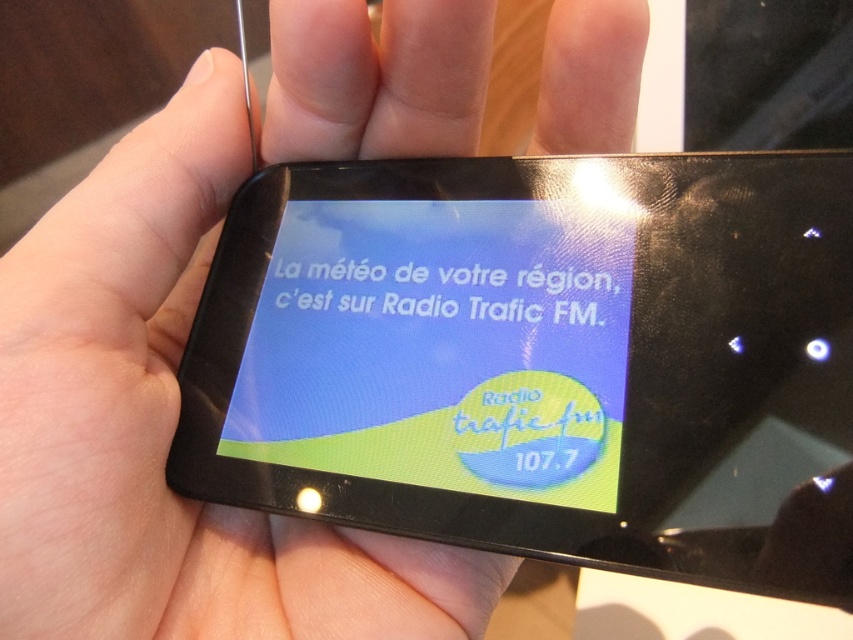
The image size is (853, 640). What do you see at coordinates (440, 348) in the screenshot? I see `matte black screen at center` at bounding box center [440, 348].

Is point (329, 308) closer to viewer compared to point (521, 292)?

That is False.

Between point (548, 236) and point (350, 266), which one is positioned behind?

The point (350, 266) is behind.

Where is `matte black screen at center`? matte black screen at center is located at coordinates (440, 348).

Can you confirm if glossy black screen at center is smaller than matte black screen at center?

No.

Between point (641, 432) and point (315, 221), which one is positioned in front?

Point (641, 432) is more forward.

This screenshot has width=853, height=640. I want to click on glossy black screen at center, so click(x=524, y=355).

Between point (349, 483) and point (564, 276), which one is positioned behind?

Positioned behind is point (564, 276).

Does glossy black screen at center have a larger size compared to white glossy text at center?

Yes.

This screenshot has width=853, height=640. What are the coordinates of `glossy black screen at center` in the screenshot? It's located at (524, 355).